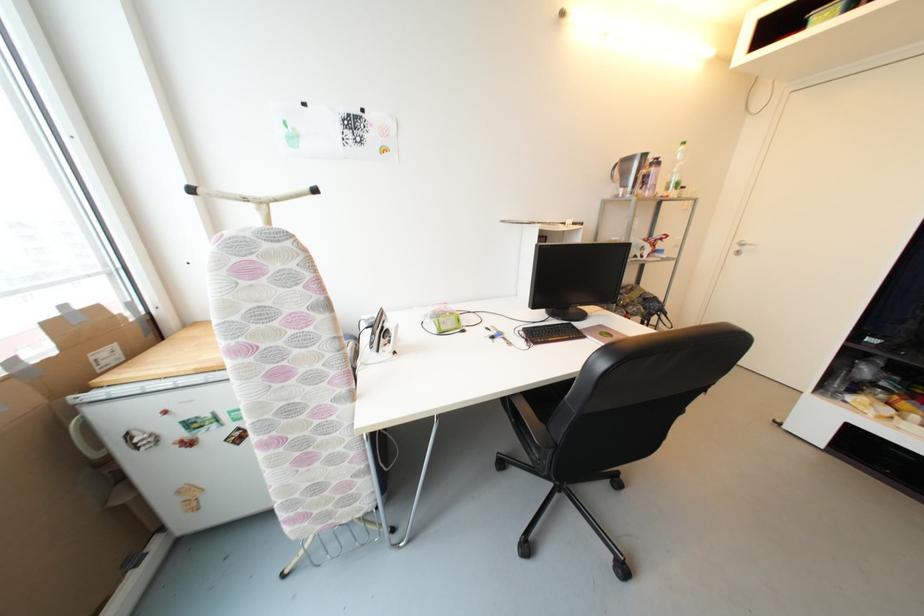
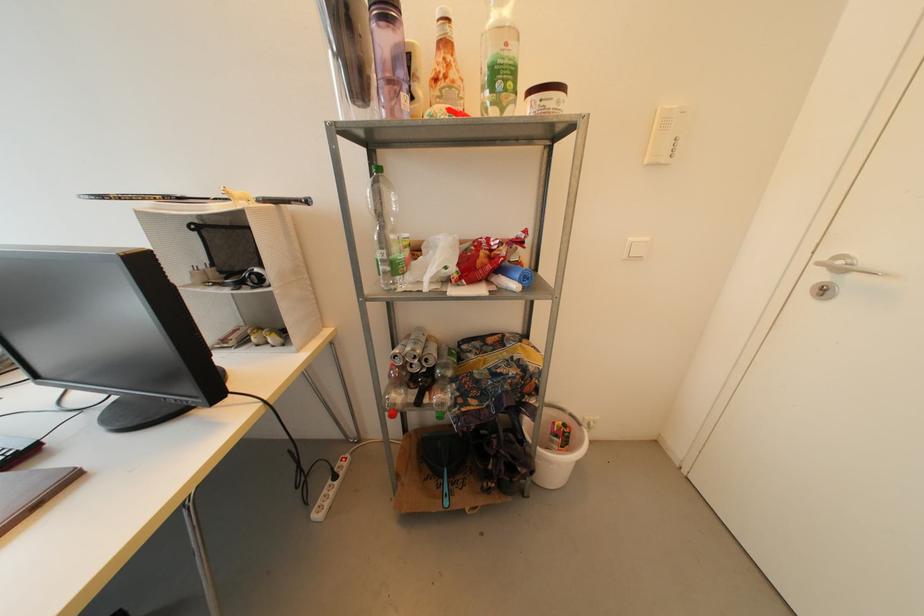
The images are taken continuously from a first-person perspective. In which direction are you moving?

The cameraman moved toward right, forward.